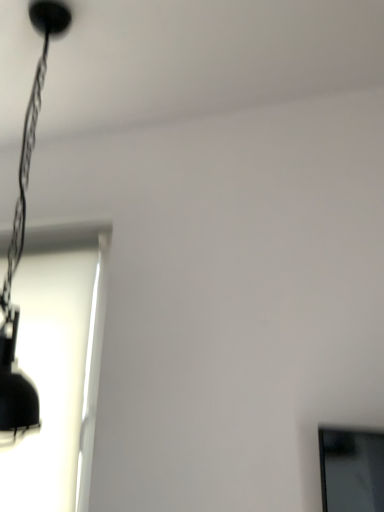
Question: From a real-world perspective, is matte black lamp at upper left under white matte window at left?

Choices:
 (A) yes
 (B) no

Answer: (B)

Question: Can you confirm if matte black lamp at upper left is wider than white matte window at left?

Choices:
 (A) yes
 (B) no

Answer: (A)

Question: Is matte black lamp at upper left completely or partially outside of white matte window at left?

Choices:
 (A) yes
 (B) no

Answer: (A)

Question: Is matte black lamp at upper left bigger than white matte window at left?

Choices:
 (A) no
 (B) yes

Answer: (B)

Question: Is matte black lamp at upper left beside white matte window at left?

Choices:
 (A) no
 (B) yes

Answer: (A)

Question: Does matte black lamp at upper left appear on the left side of white matte window at left?

Choices:
 (A) no
 (B) yes

Answer: (A)

Question: Is there a large distance between white matte window at left and matte black lamp at upper left?

Choices:
 (A) yes
 (B) no

Answer: (B)

Question: Considering the relative positions of white matte window at left and matte black lamp at upper left in the image provided, is white matte window at left to the left of matte black lamp at upper left from the viewer's perspective?

Choices:
 (A) yes
 (B) no

Answer: (A)

Question: Considering the relative sizes of white matte window at left and matte black lamp at upper left in the image provided, is white matte window at left bigger than matte black lamp at upper left?

Choices:
 (A) no
 (B) yes

Answer: (A)

Question: Could you tell me if white matte window at left is facing matte black lamp at upper left?

Choices:
 (A) no
 (B) yes

Answer: (B)

Question: Does white matte window at left contain matte black lamp at upper left?

Choices:
 (A) yes
 (B) no

Answer: (B)

Question: From the image's perspective, is white matte window at left located beneath matte black lamp at upper left?

Choices:
 (A) no
 (B) yes

Answer: (B)

Question: Considering the positions of matte black lamp at upper left and white matte window at left in the image, is matte black lamp at upper left taller or shorter than white matte window at left?

Choices:
 (A) tall
 (B) short

Answer: (A)